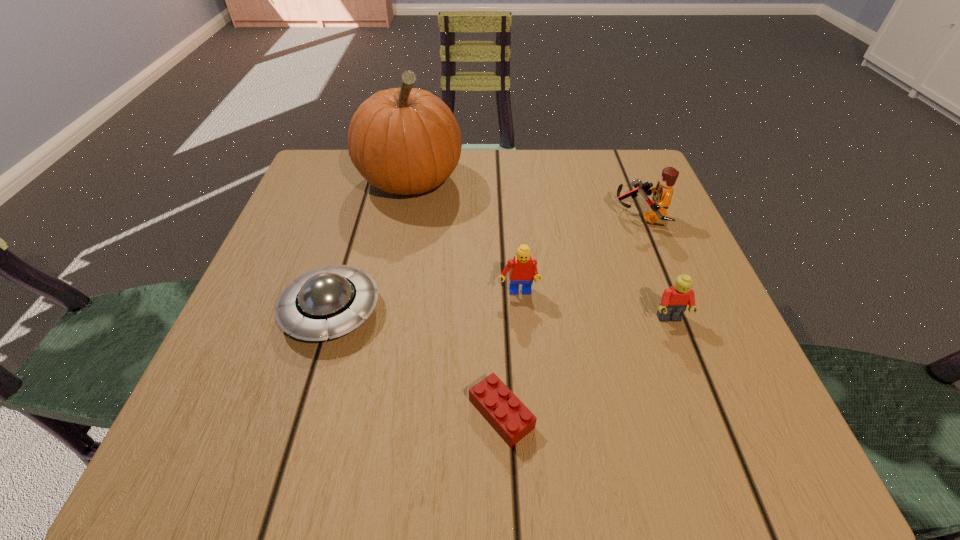
This screenshot has height=540, width=960. What are the coordinates of `free space located 0.080m holding a crossbow in the hands of the farthest Lego` in the screenshot? It's located at (576, 216).

This screenshot has width=960, height=540. In order to click on vacant point located 0.090m on the front-facing side of the second farthest Lego in this screenshot , I will do `click(521, 345)`.

Where is `free space located 0.150m on the face of the second nearest Lego`? The width and height of the screenshot is (960, 540). free space located 0.150m on the face of the second nearest Lego is located at coordinates (705, 414).

Where is `vacant space located on the back of the saucer`? Image resolution: width=960 pixels, height=540 pixels. vacant space located on the back of the saucer is located at coordinates (377, 160).

You are a GUI agent. You are given a task and a screenshot of the screen. Output one action in this format:
    pyautogui.click(x=<x>, y=<y>)
    Task: Click on the free region located on the right of the shortest object
    This screenshot has width=960, height=540.
    Given the screenshot: What is the action you would take?
    pyautogui.click(x=621, y=414)

Where is `pumpkin at the far edge`? pumpkin at the far edge is located at coordinates (406, 140).

Find the location of a particular element. This screenshot has height=540, width=960. Lego that is at the far edge is located at coordinates (662, 193).

Identify the location of object located at the near edge. The image size is (960, 540). (509, 417).

Find the location of a particular element. The image size is (960, 540). pumpkin present at the left edge is located at coordinates (406, 140).

I want to click on saucer at the left edge, so click(327, 302).